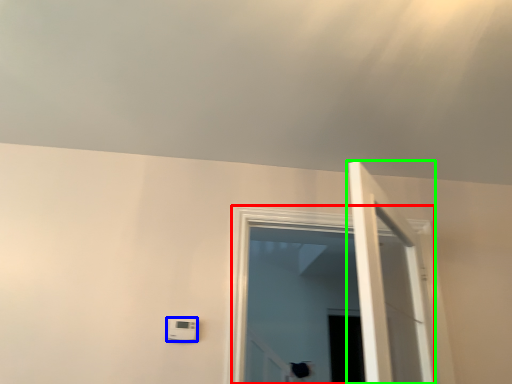
Question: Which object is the closest to the window (highlighted by a red box)? Choose among these: light switch (highlighted by a blue box) or door (highlighted by a green box).

Choices:
 (A) light switch
 (B) door

Answer: (A)